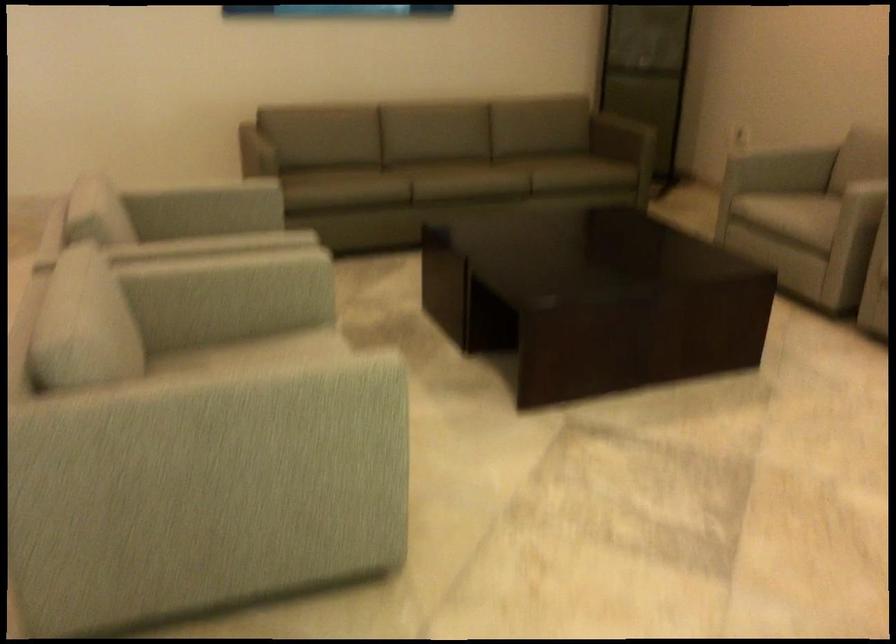
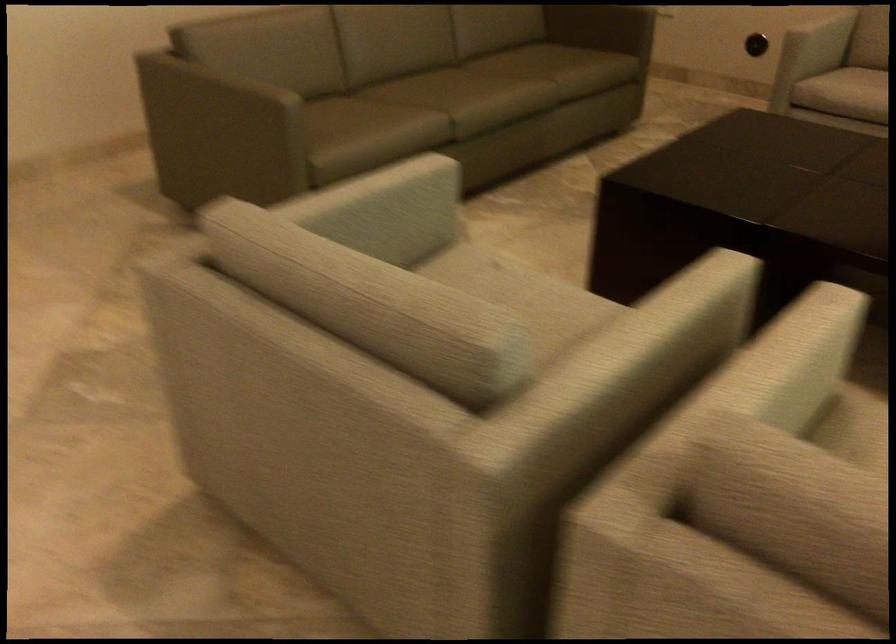
In a continuous first-person perspective shot, in which direction is the camera moving?

The cameraman moved toward left, forward.